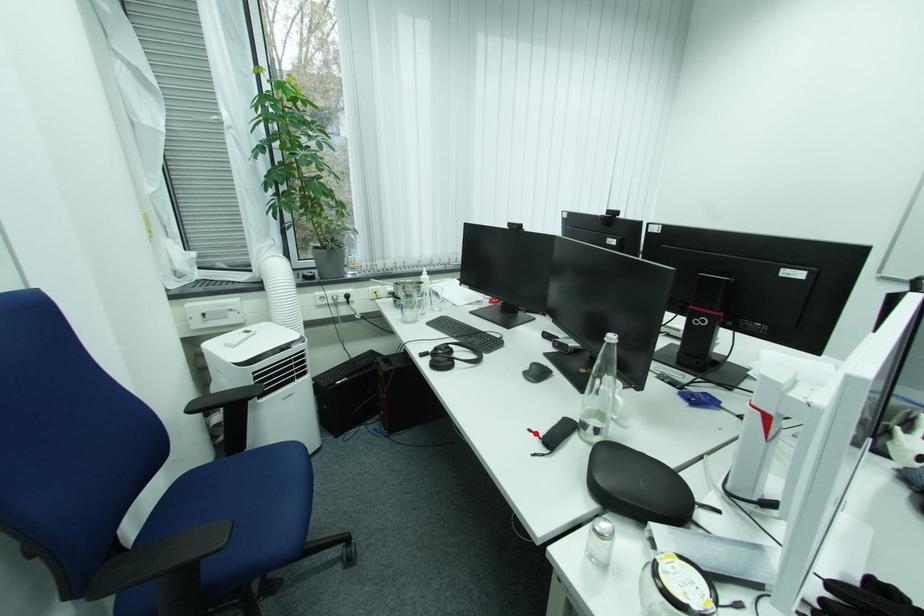
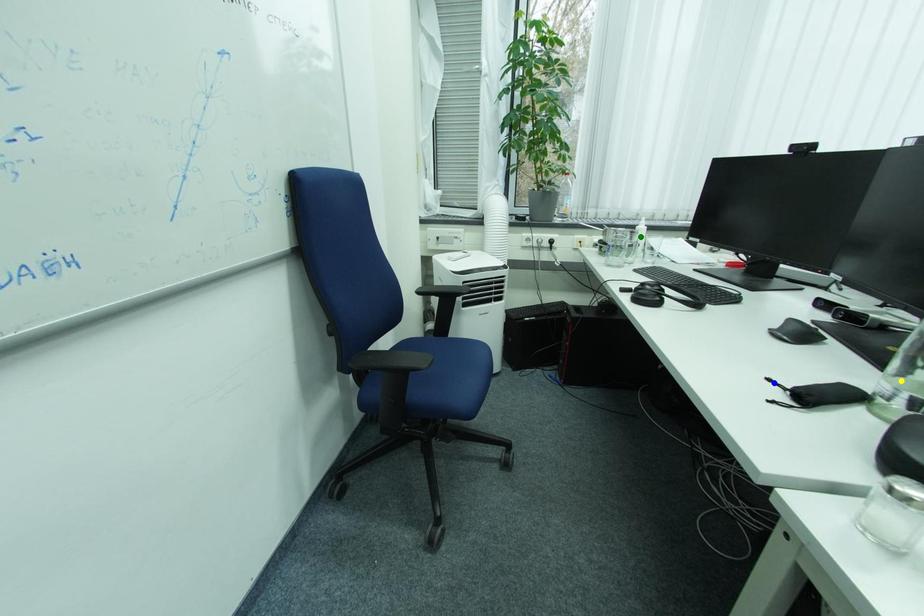
Question: I am providing you with two images of the same scene from different viewpoints. A red point is marked on the first image. You are given multiple points on the second image. In image 2, which mark is for the same physical point as the one in image 1?

Choices:
 (A) green point
 (B) yellow point
 (C) blue point

Answer: (C)